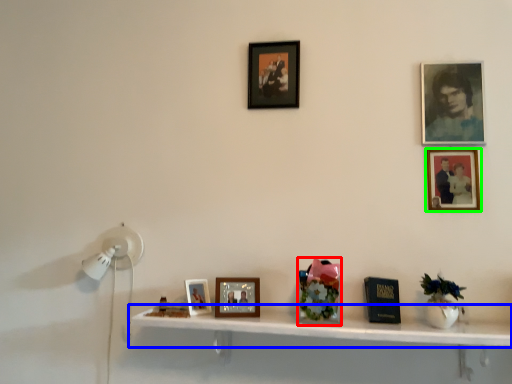
Question: Considering the real-world distances, which object is farthest from art (highlighted by a red box)? shelf (highlighted by a blue box) or picture frame (highlighted by a green box)?

Choices:
 (A) shelf
 (B) picture frame

Answer: (B)